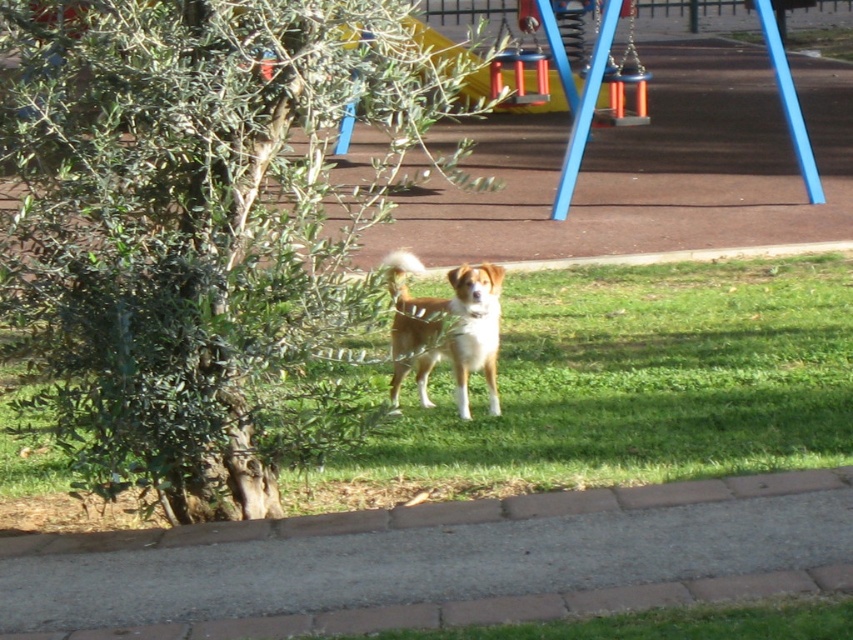
Question: Which point is farther to the camera?

Choices:
 (A) green leafy tree at center
 (B) green grass at center

Answer: (B)

Question: Which of these objects is positioned closest to the brown fur dog at center?

Choices:
 (A) green leafy tree at center
 (B) green grass at center

Answer: (B)

Question: Which object is closer to the camera taking this photo?

Choices:
 (A) green grass at center
 (B) green leafy tree at center

Answer: (B)

Question: From the image, what is the correct spatial relationship of green leafy tree at center in relation to brown fur dog at center?

Choices:
 (A) below
 (B) above

Answer: (B)

Question: Does green grass at center lie behind brown fur dog at center?

Choices:
 (A) no
 (B) yes

Answer: (B)

Question: Is green grass at center closer to the viewer compared to brown fur dog at center?

Choices:
 (A) no
 (B) yes

Answer: (A)